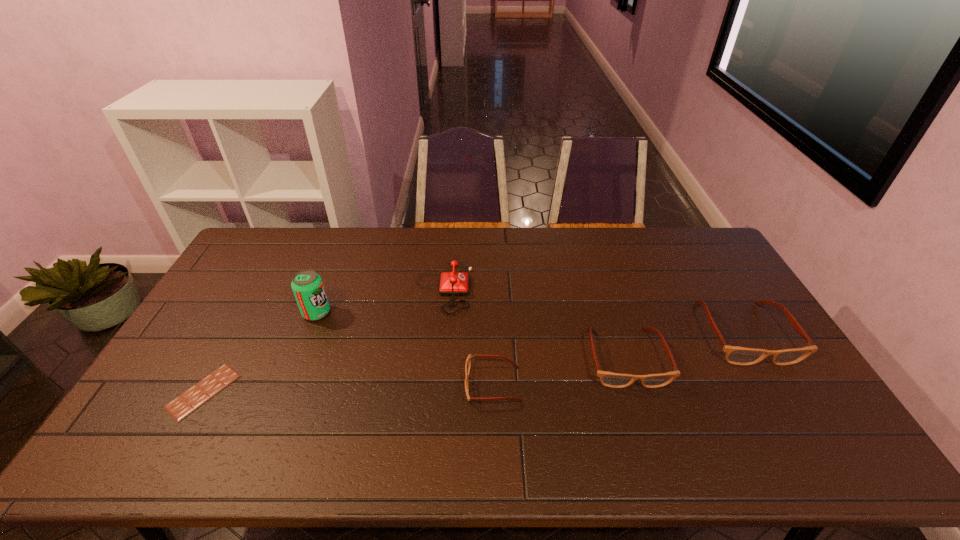
This screenshot has width=960, height=540. I want to click on the second shortest object, so click(x=468, y=361).

Image resolution: width=960 pixels, height=540 pixels. I want to click on the shortest spectacles, so click(x=468, y=361).

What are the coordinates of `the second shortest spectacles` in the screenshot? It's located at (609, 379).

Locate an element on the screen. the fifth object from left to right is located at coordinates (609, 379).

You are a GUI agent. You are given a task and a screenshot of the screen. Output one action in this format:
    pyautogui.click(x=<x>, y=<y>)
    Task: Click on the rightmost spectacles
    The image size is (960, 540).
    Given the screenshot: What is the action you would take?
    pyautogui.click(x=736, y=355)

Find the location of `telephone`. telephone is located at coordinates (452, 283).

Image resolution: width=960 pixels, height=540 pixels. Identify the location of the tallest object. click(x=307, y=286).

Where is `the fifth object from right to left`? the fifth object from right to left is located at coordinates (307, 286).

Locate an element on the screen. The width and height of the screenshot is (960, 540). the shortest object is located at coordinates (197, 395).

Identify the location of the leftmost object. (197, 395).